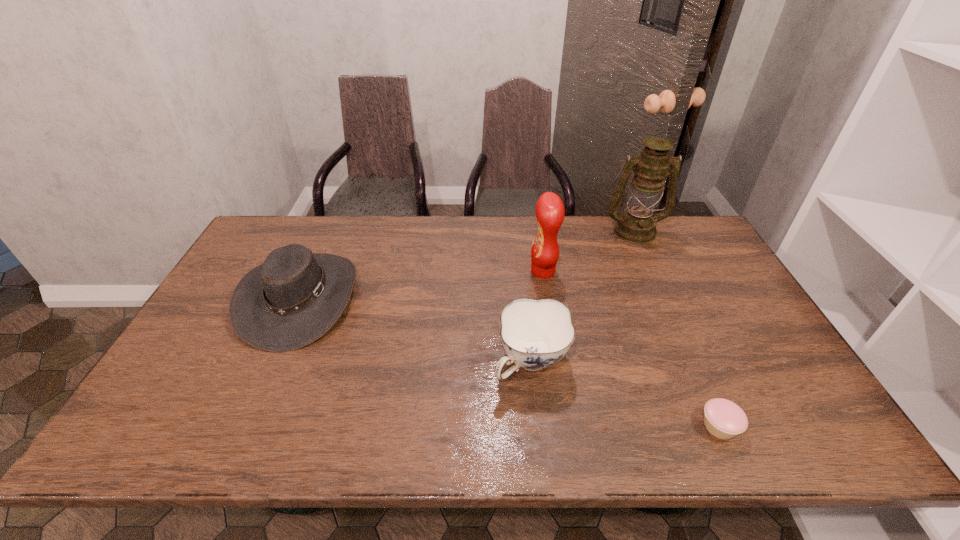
Find the location of a particular element. Image resolution: width=960 pixels, height=540 pixels. oil lamp is located at coordinates 637,225.

Where is `the tallest object`? the tallest object is located at coordinates point(637,225).

Where is `condiment`? The width and height of the screenshot is (960, 540). condiment is located at coordinates (550, 212).

The width and height of the screenshot is (960, 540). In order to click on cowboy hat in this screenshot , I will do `click(291, 300)`.

The image size is (960, 540). I want to click on chinaware, so click(x=535, y=334).

Identify the location of cupcake. (724, 419).

The height and width of the screenshot is (540, 960). I want to click on the shortest object, so click(x=724, y=419).

You are a GUI agent. You are given a task and a screenshot of the screen. Output one action in this format:
    pyautogui.click(x=<x>, y=<y>)
    Task: Click on the free space located 0.400m on the front of the tallest object
    
    Given the screenshot: What is the action you would take?
    [x=681, y=332]

The image size is (960, 540). In order to click on vacant space located on the label side of the second tallest object in this screenshot , I will do `click(482, 271)`.

Find the location of `vacant area located 0.340m on the label side of the second tallest object`. vacant area located 0.340m on the label side of the second tallest object is located at coordinates (421, 271).